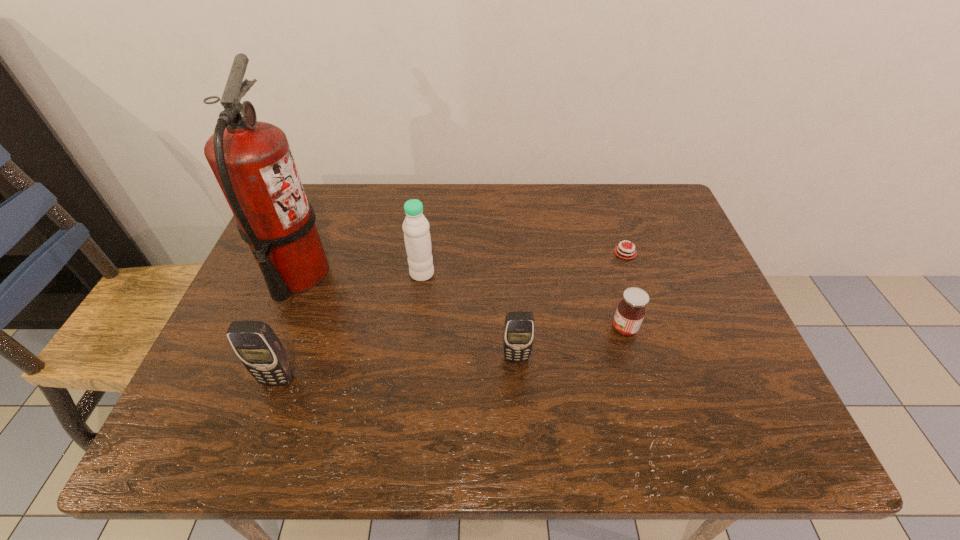
Locate an element on the screen. vacant space that satisfies the following two spatial constraints: 1. on the label side of the jam; 2. on the front face of the farther cellular telephone is located at coordinates (633, 357).

The height and width of the screenshot is (540, 960). Find the location of `free spot that satisfies the following two spatial constraints: 1. on the label side of the jam; 2. on the front face of the fourth shortest object`. free spot that satisfies the following two spatial constraints: 1. on the label side of the jam; 2. on the front face of the fourth shortest object is located at coordinates (639, 380).